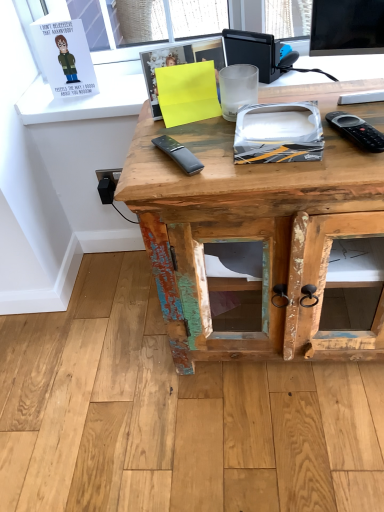
Question: Is yellow paper at center, positioned as the second book in top-to-bottom order, positioned with its back to matte paper card at upper left, placed as the second book when sorted from right to left?

Choices:
 (A) yes
 (B) no

Answer: (A)

Question: Is yellow paper at center, acting as the first book starting from the bottom, taller than matte paper card at upper left, placed as the second book when sorted from right to left?

Choices:
 (A) no
 (B) yes

Answer: (A)

Question: Does yellow paper at center, positioned as the second book in top-to-bottom order, come in front of matte paper card at upper left, positioned as the 1th book in back-to-front order?

Choices:
 (A) no
 (B) yes

Answer: (B)

Question: Is yellow paper at center, arranged as the second book when viewed from the back, to the left of matte paper card at upper left, positioned as the 1th book in back-to-front order, from the viewer's perspective?

Choices:
 (A) no
 (B) yes

Answer: (A)

Question: Are yellow paper at center, arranged as the second book when viewed from the back, and matte paper card at upper left, which ranks as the second book in bottom-to-top order, making contact?

Choices:
 (A) yes
 (B) no

Answer: (B)

Question: Does point (172, 56) appear closer or farther from the camera than point (66, 96)?

Choices:
 (A) closer
 (B) farther

Answer: (A)

Question: Is yellow paper at center, positioned as the second book in top-to-bottom order, wider or thinner than matte paper card at upper left, positioned as the 1th book in back-to-front order?

Choices:
 (A) wide
 (B) thin

Answer: (B)

Question: From a real-world perspective, relative to matte paper card at upper left, the 1th book from the left, is yellow paper at center, the 1th book viewed from the front, vertically above or below?

Choices:
 (A) above
 (B) below

Answer: (A)

Question: Considering the positions of yellow paper at center, which ranks as the 1th book in right-to-left order, and matte paper card at upper left, placed as the second book when sorted from right to left, in the image, is yellow paper at center, which ranks as the 1th book in right-to-left order, bigger or smaller than matte paper card at upper left, placed as the second book when sorted from right to left,?

Choices:
 (A) small
 (B) big

Answer: (A)

Question: From a real-world perspective, is yellow paper at center, which ranks as the 1th book in right-to-left order, positioned above or below rustic wood desk at center?

Choices:
 (A) below
 (B) above

Answer: (B)

Question: Considering the positions of yellow paper at center, the 1th book viewed from the front, and rustic wood desk at center in the image, is yellow paper at center, the 1th book viewed from the front, taller or shorter than rustic wood desk at center?

Choices:
 (A) short
 (B) tall

Answer: (A)

Question: Is point (172, 55) positioned closer to the camera than point (140, 158)?

Choices:
 (A) closer
 (B) farther

Answer: (B)

Question: Considering the positions of yellow paper at center, the second book viewed from the left, and rustic wood desk at center in the image, is yellow paper at center, the second book viewed from the left, wider or thinner than rustic wood desk at center?

Choices:
 (A) thin
 (B) wide

Answer: (A)

Question: Is matte paper card at upper left, which is counted as the 1th book, starting from the top, to the left or to the right of yellow paper at center, the 1th book viewed from the front, in the image?

Choices:
 (A) right
 (B) left

Answer: (B)

Question: Is matte paper card at upper left, which is counted as the 1th book, starting from the top, wider or thinner than yellow paper at center, the second book viewed from the left?

Choices:
 (A) wide
 (B) thin

Answer: (A)